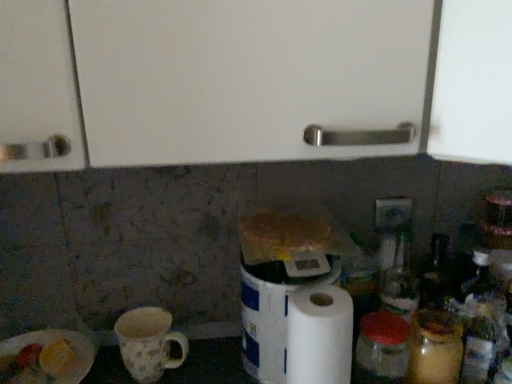
Question: Based on their positions, is white matte paper towel at center-right located to the left or right of floral ceramic mug at lower left?

Choices:
 (A) left
 (B) right

Answer: (B)

Question: From the image's perspective, is white matte paper towel at center-right above or below floral ceramic mug at lower left?

Choices:
 (A) above
 (B) below

Answer: (A)

Question: Which is farther from the white matte paper towel at center-right?

Choices:
 (A) green plastic electric outlet at upper right
 (B) white paper plate at lower left
 (C) floral ceramic mug at lower left
 (D) white paper towel at center

Answer: (B)

Question: Based on their relative distances, which object is nearer to the floral ceramic mug at lower left?

Choices:
 (A) white paper towel at center
 (B) white matte paper towel at center-right
 (C) white paper plate at lower left
 (D) green plastic electric outlet at upper right

Answer: (C)